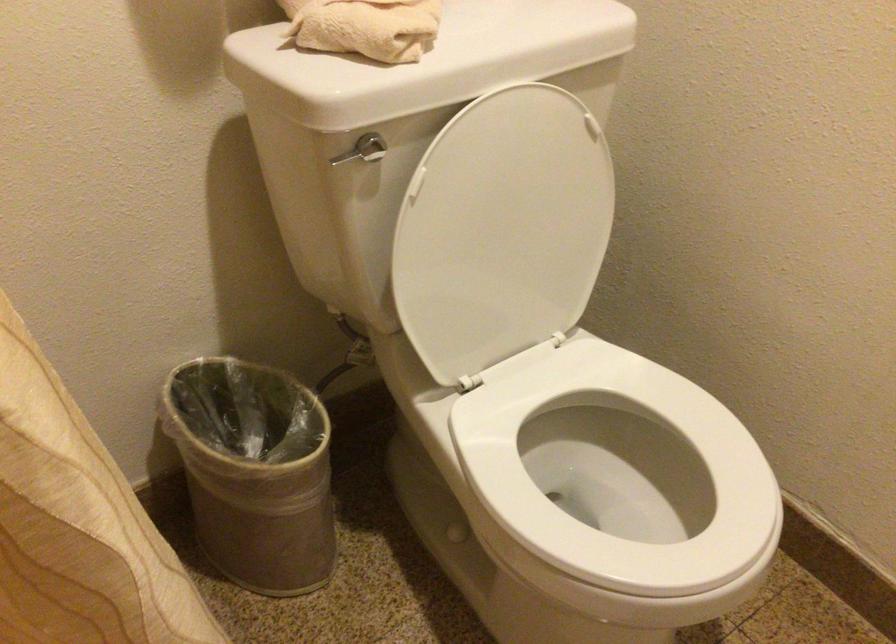
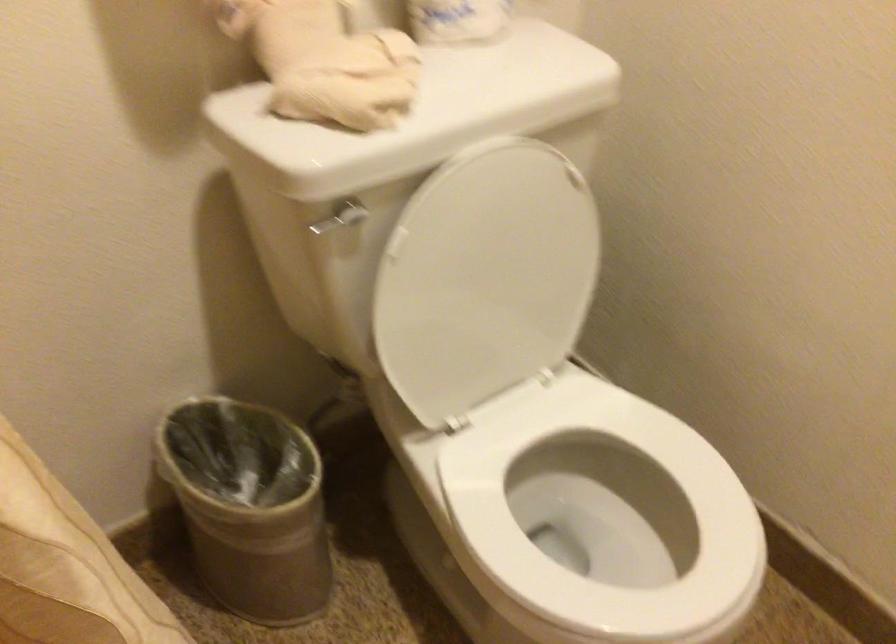
Question: How did the camera likely rotate?

Choices:
 (A) Left
 (B) Right
 (C) Up
 (D) Down

Answer: (D)